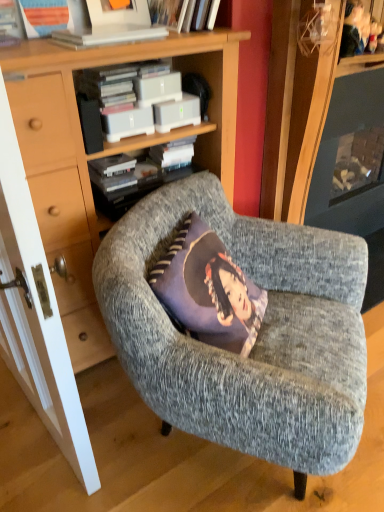
Question: From a real-world perspective, is textured gray armchair at center positioned under white plastic book at upper center based on gravity?

Choices:
 (A) yes
 (B) no

Answer: (A)

Question: From the image's perspective, does textured gray armchair at center appear higher than white plastic book at upper center?

Choices:
 (A) yes
 (B) no

Answer: (B)

Question: Can you confirm if textured gray armchair at center is shorter than white plastic book at upper center?

Choices:
 (A) no
 (B) yes

Answer: (A)

Question: Does textured gray armchair at center appear on the right side of white plastic book at upper center?

Choices:
 (A) no
 (B) yes

Answer: (B)

Question: Is textured gray armchair at center touching white plastic book at upper center?

Choices:
 (A) no
 (B) yes

Answer: (A)

Question: Is textured gray armchair at center wider than white plastic book at upper center?

Choices:
 (A) no
 (B) yes

Answer: (B)

Question: Is white matte book at upper center touching white plastic book at upper center?

Choices:
 (A) yes
 (B) no

Answer: (B)

Question: Does white matte book at upper center have a larger size compared to white plastic book at upper center?

Choices:
 (A) yes
 (B) no

Answer: (A)

Question: Is white matte book at upper center facing away from white plastic book at upper center?

Choices:
 (A) yes
 (B) no

Answer: (B)

Question: Is white matte book at upper center aimed at white plastic book at upper center?

Choices:
 (A) yes
 (B) no

Answer: (B)

Question: Does white matte book at upper center appear on the left side of white plastic book at upper center?

Choices:
 (A) yes
 (B) no

Answer: (B)

Question: Is white matte book at upper center further to the viewer compared to white plastic book at upper center?

Choices:
 (A) yes
 (B) no

Answer: (A)

Question: Considering the relative sizes of white wood door at left and white matte book at upper center in the image provided, is white wood door at left shorter than white matte book at upper center?

Choices:
 (A) no
 (B) yes

Answer: (A)